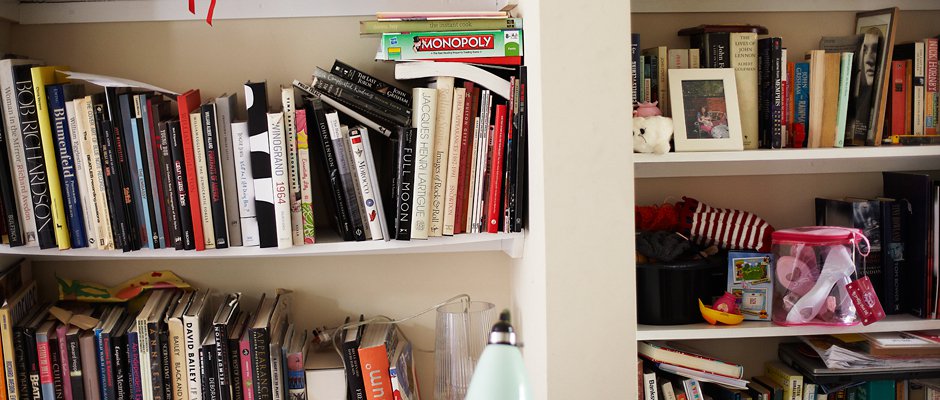
I want to click on ceramic figurine, so click(652, 129).